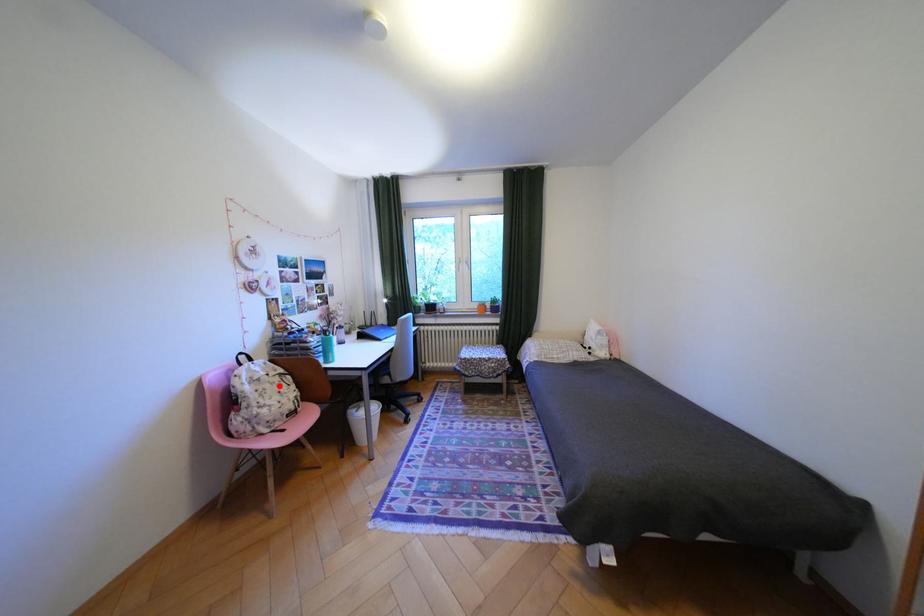
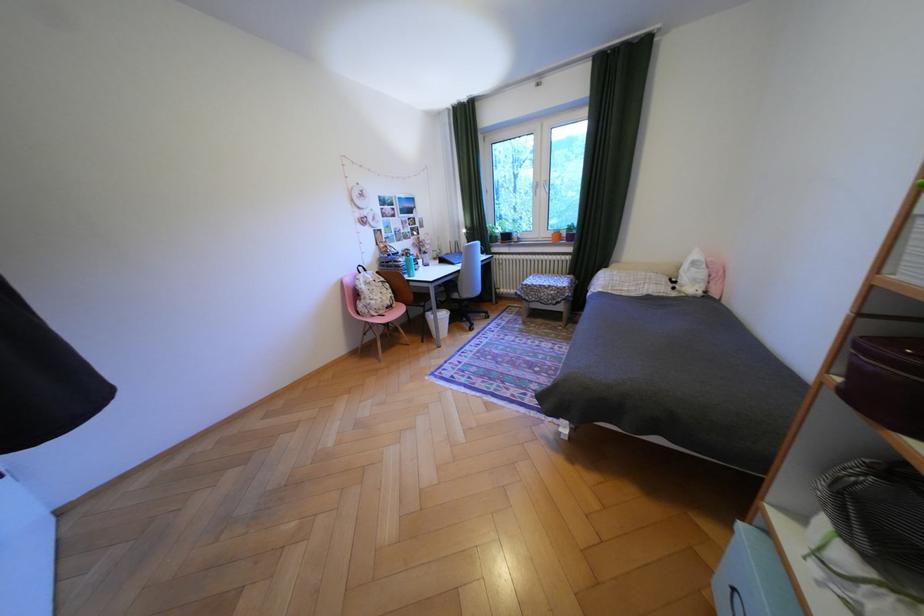
Question: I am providing you with two images of the same scene from different viewpoints. A red point is marked on the first image. Is the red point's position out of view in image 2?

Choices:
 (A) Yes
 (B) No

Answer: (B)